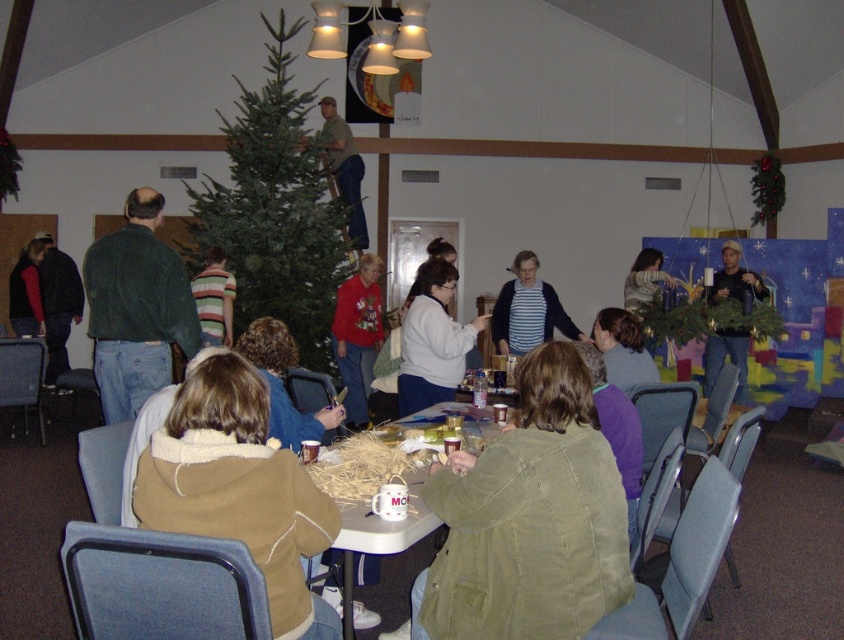
Question: Does green matte christmas tree at center appear on the left side of green sweater at left?

Choices:
 (A) yes
 (B) no

Answer: (A)

Question: Which point is closer to the camera?

Choices:
 (A) (277, 310)
 (B) (740, 300)
 (C) (120, 336)

Answer: (C)

Question: Considering the relative positions of red sweater at center and camouflage fabric shirt at upper center in the image provided, where is red sweater at center located with respect to camouflage fabric shirt at upper center?

Choices:
 (A) right
 (B) left

Answer: (A)

Question: Considering the relative positions of striped cotton shirt at center and camouflage fabric shirt at upper center in the image provided, where is striped cotton shirt at center located with respect to camouflage fabric shirt at upper center?

Choices:
 (A) below
 (B) above

Answer: (A)

Question: Which point is closer to the camera?

Choices:
 (A) white fleece sweater at center
 (B) white paper cup at center
 (C) green sweater at left

Answer: (B)

Question: Which point appears farthest from the camera in this image?

Choices:
 (A) (521, 285)
 (B) (26, 266)
 (C) (93, 349)

Answer: (B)